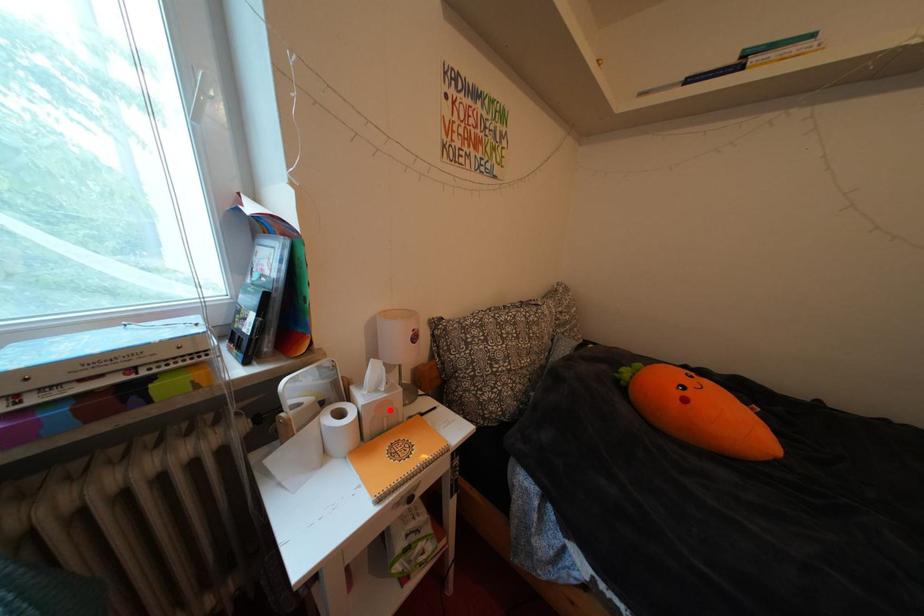
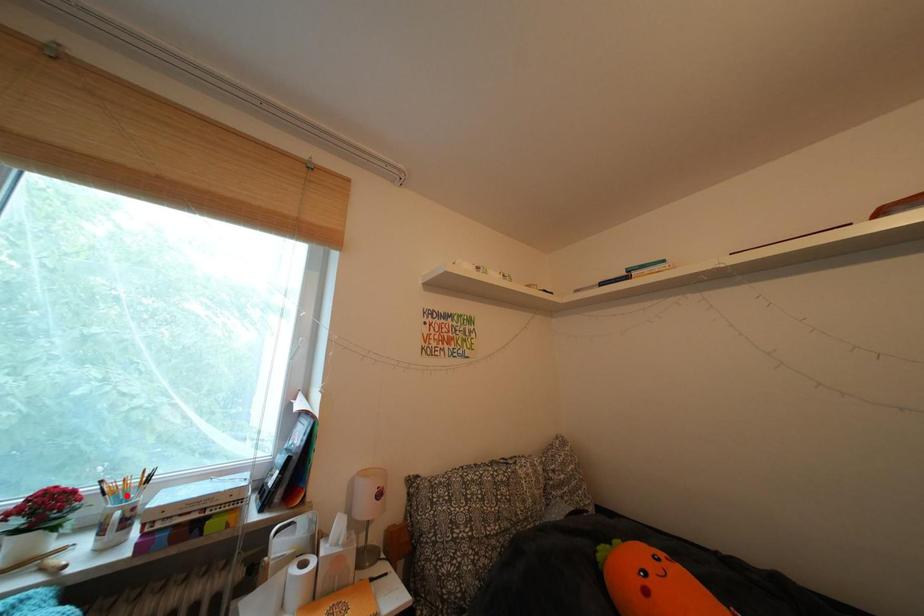
I am providing you with two images of the same scene from different viewpoints. A red point is marked on the first image and another point is marked on the second image. Is the marked point in image1 the same physical position as the marked point in image2?

No